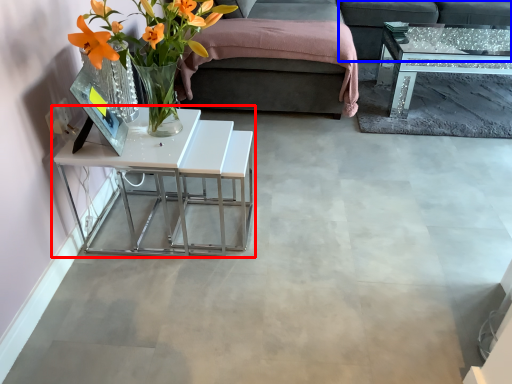
Question: Which object appears farthest to the camera in this image, table (highlighted by a red box) or couch (highlighted by a blue box)?

Choices:
 (A) table
 (B) couch

Answer: (B)